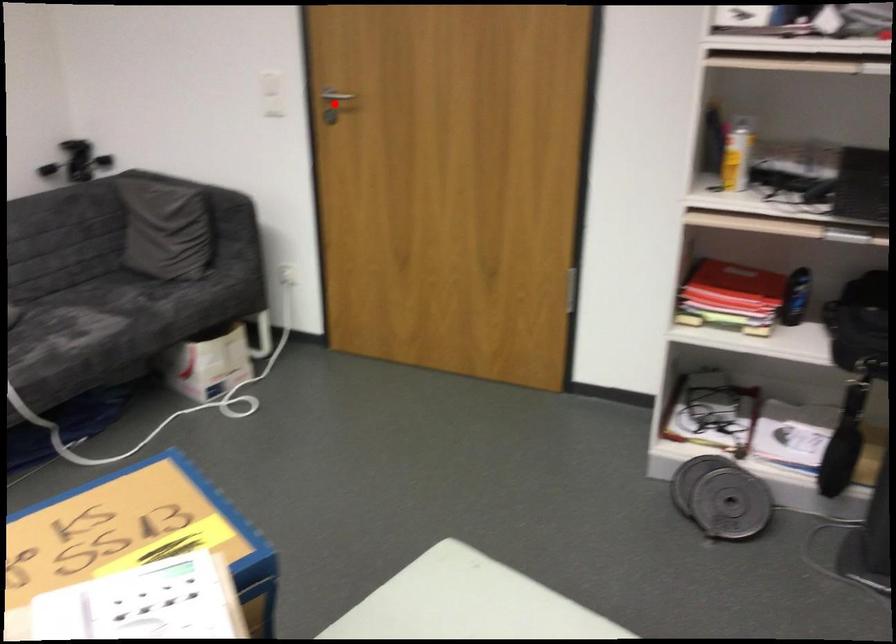
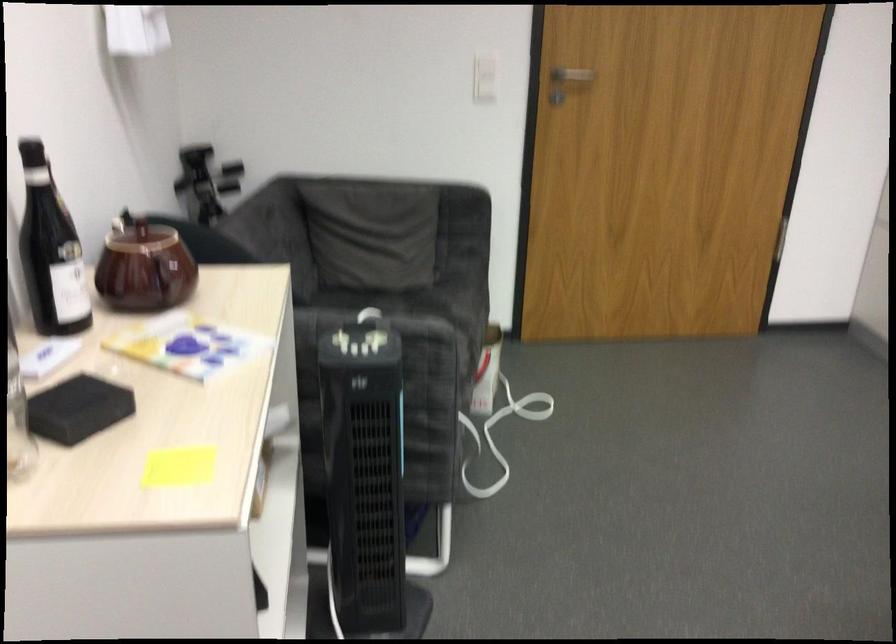
Locate, in the second image, the point that corresponds to the highlighted location in the first image.

(569, 77)